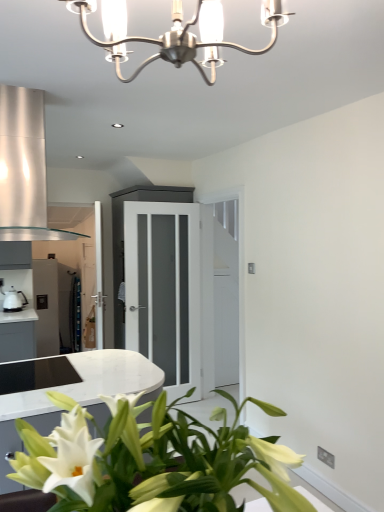
Question: Considering the relative sizes of white glossy kettle at left and brushed metal chandelier at upper center in the image provided, is white glossy kettle at left smaller than brushed metal chandelier at upper center?

Choices:
 (A) yes
 (B) no

Answer: (A)

Question: Does white glossy kettle at left have a lesser height compared to brushed metal chandelier at upper center?

Choices:
 (A) no
 (B) yes

Answer: (B)

Question: From the image's perspective, is white glossy kettle at left over brushed metal chandelier at upper center?

Choices:
 (A) yes
 (B) no

Answer: (B)

Question: Considering the relative positions of white glossy kettle at left and brushed metal chandelier at upper center in the image provided, is white glossy kettle at left to the left of brushed metal chandelier at upper center from the viewer's perspective?

Choices:
 (A) yes
 (B) no

Answer: (A)

Question: Does white glossy kettle at left touch brushed metal chandelier at upper center?

Choices:
 (A) no
 (B) yes

Answer: (A)

Question: Considering the relative sizes of white glossy kettle at left and brushed metal chandelier at upper center in the image provided, is white glossy kettle at left wider than brushed metal chandelier at upper center?

Choices:
 (A) no
 (B) yes

Answer: (A)

Question: Considering the relative sizes of white glossy houseplant at lower left and white frosted glass door at center in the image provided, is white glossy houseplant at lower left thinner than white frosted glass door at center?

Choices:
 (A) yes
 (B) no

Answer: (B)

Question: Is white glossy houseplant at lower left taller than white frosted glass door at center?

Choices:
 (A) yes
 (B) no

Answer: (B)

Question: From the image's perspective, is white glossy houseplant at lower left below white frosted glass door at center?

Choices:
 (A) yes
 (B) no

Answer: (A)

Question: From a real-world perspective, is white glossy houseplant at lower left on white frosted glass door at center?

Choices:
 (A) no
 (B) yes

Answer: (B)

Question: Is white frosted glass door at center completely or partially inside white glossy houseplant at lower left?

Choices:
 (A) no
 (B) yes

Answer: (A)

Question: Is white glossy houseplant at lower left outside white frosted glass door at center?

Choices:
 (A) yes
 (B) no

Answer: (A)

Question: Is white glossy houseplant at lower left far from brushed metal chandelier at upper center?

Choices:
 (A) yes
 (B) no

Answer: (B)